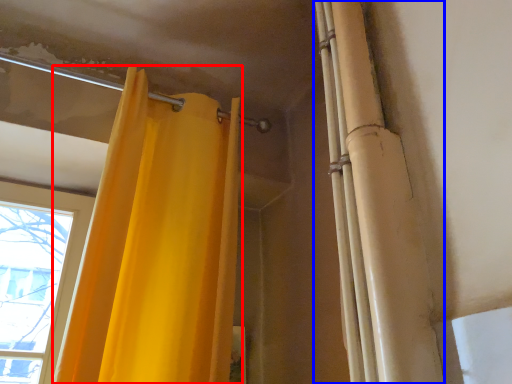
Question: Which of the following is the closest to the observer, curtain (highlighted by a red box) or shower curtain (highlighted by a blue box)?

Choices:
 (A) curtain
 (B) shower curtain

Answer: (B)